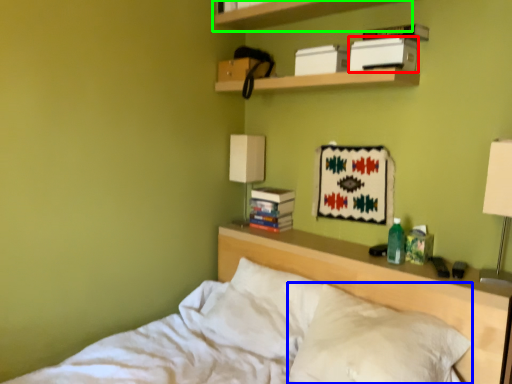
Question: Based on their relative distances, which object is nearer to paperback book (highlighted by a red box)? Choose from pillow (highlighted by a blue box) and shelf (highlighted by a green box).

Choices:
 (A) pillow
 (B) shelf

Answer: (B)